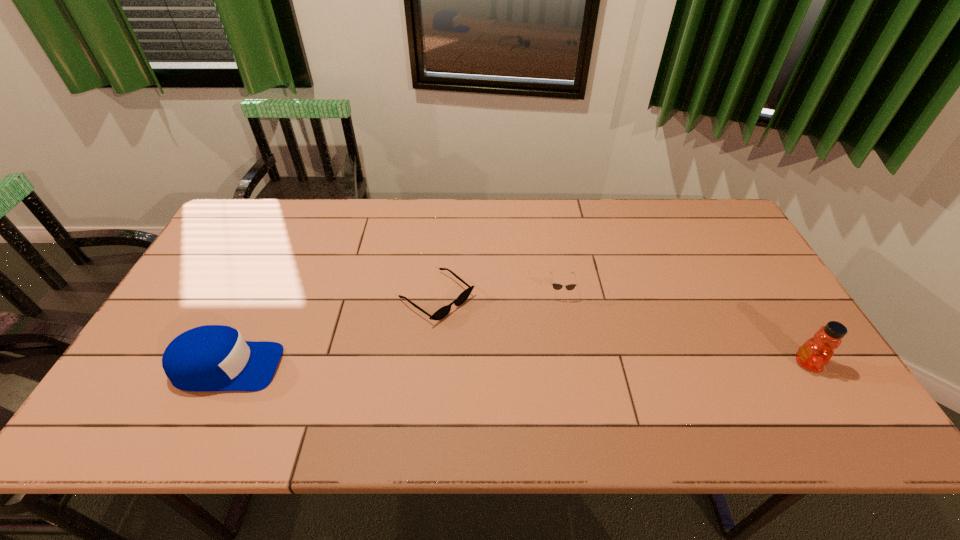
Identify the location of free region located in front of the lenses of the second shortest object. This screenshot has width=960, height=540. (568, 392).

At what (x,y) coordinates should I click in order to perform the action: click on vacant space situated in front of the lenses of the second shortest object. Please return your answer as a coordinate pair (x, y). This screenshot has width=960, height=540. Looking at the image, I should click on (565, 360).

Locate an element on the screen. free spot located 0.270m on the front-facing side of the left sunglasses is located at coordinates (542, 379).

At what (x,y) coordinates should I click in order to perform the action: click on vacant space situated 0.180m on the front-facing side of the left sunglasses. Please return your answer as a coordinate pair (x, y). Looking at the image, I should click on (514, 357).

The height and width of the screenshot is (540, 960). I want to click on vacant area located 0.330m on the front-facing side of the left sunglasses, so click(x=563, y=394).

Locate an element on the screen. baseball cap that is positioned at the near edge is located at coordinates (207, 358).

Identify the location of honey present at the near edge. This screenshot has height=540, width=960. (816, 352).

Where is `object that is at the left edge`? The height and width of the screenshot is (540, 960). object that is at the left edge is located at coordinates [207, 358].

Identify the location of object that is positioned at the right edge. The height and width of the screenshot is (540, 960). (816, 352).

Locate an element on the screen. object that is at the near left corner is located at coordinates (207, 358).